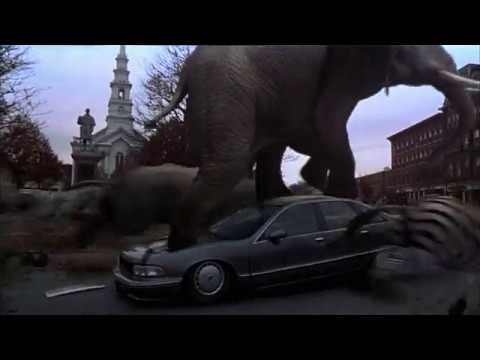
At what (x,y) coordinates should I click in order to perform the action: click on 1 statue. Please return your answer as a coordinate pair (x, y). This screenshot has width=480, height=360. Looking at the image, I should click on (90, 126).